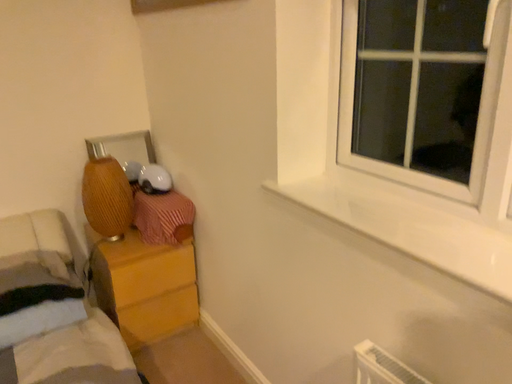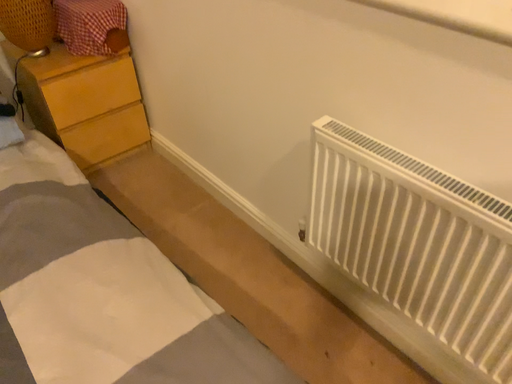
Question: Which way did the camera rotate in the video?

Choices:
 (A) rotated right
 (B) rotated left

Answer: (A)